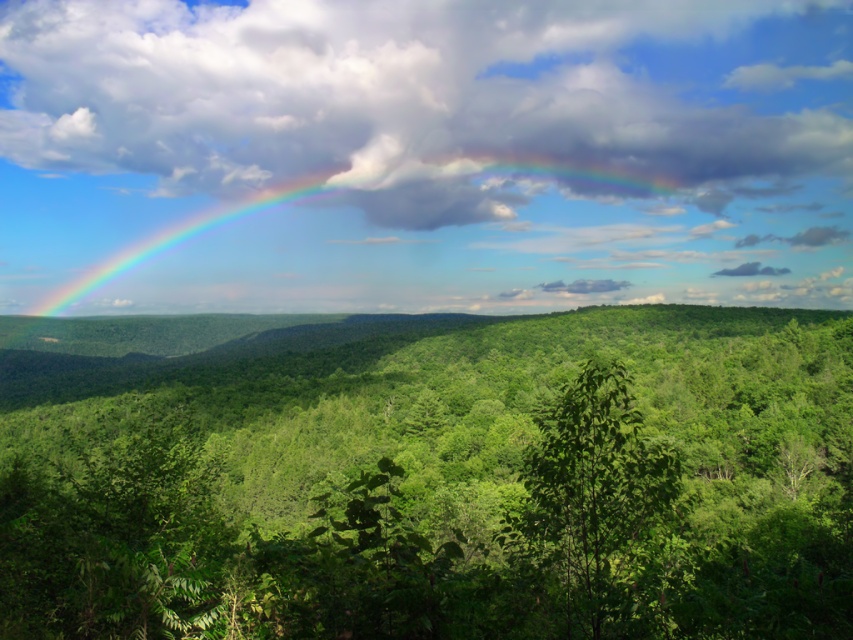
Question: Estimate the real-world distances between objects in this image. Which object is farther from the green leafy tree at lower left?

Choices:
 (A) rainbow at left
 (B) green leafy forest at center

Answer: (A)

Question: Can you confirm if green leafy tree at center is bigger than rainbow at left?

Choices:
 (A) no
 (B) yes

Answer: (A)

Question: Does green leafy forest at center appear on the left side of cloudy sky at upper center?

Choices:
 (A) no
 (B) yes

Answer: (B)

Question: Which point is closer to the camera?

Choices:
 (A) (73, 524)
 (B) (51, 269)
 (C) (354, 397)

Answer: (A)

Question: Does green leafy forest at center come in front of rainbow at left?

Choices:
 (A) yes
 (B) no

Answer: (A)

Question: Which object is closer to the camera taking this photo?

Choices:
 (A) rainbow at left
 (B) green leafy tree at center

Answer: (B)